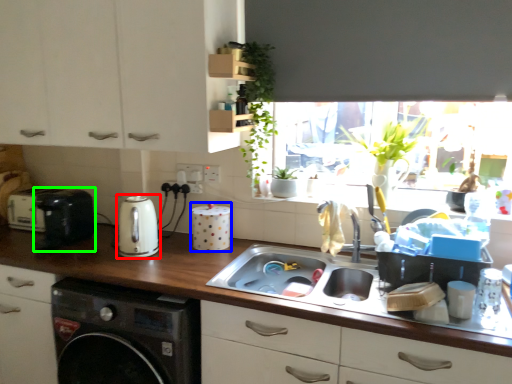
Question: Considering the real-world distances, which object is farthest from kitchen appliance (highlighted by a red box)? appliance (highlighted by a blue box) or appliance (highlighted by a green box)?

Choices:
 (A) appliance
 (B) appliance

Answer: (B)